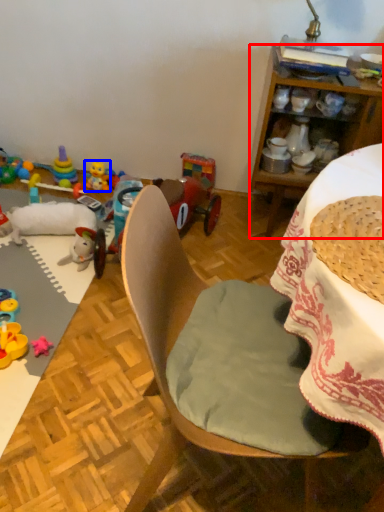
Question: Which object appears farthest to the camera in this image, cabinetry (highlighted by a red box) or toy (highlighted by a blue box)?

Choices:
 (A) cabinetry
 (B) toy

Answer: (B)